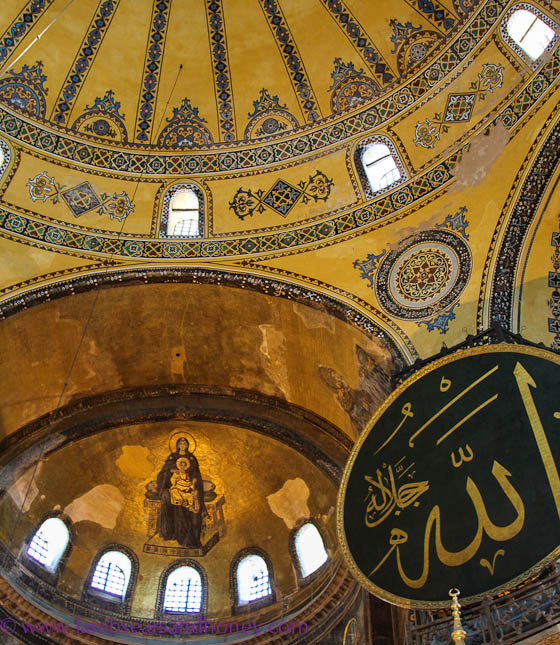
Where is `hooks`? This screenshot has width=560, height=645. hooks is located at coordinates (390, 508).